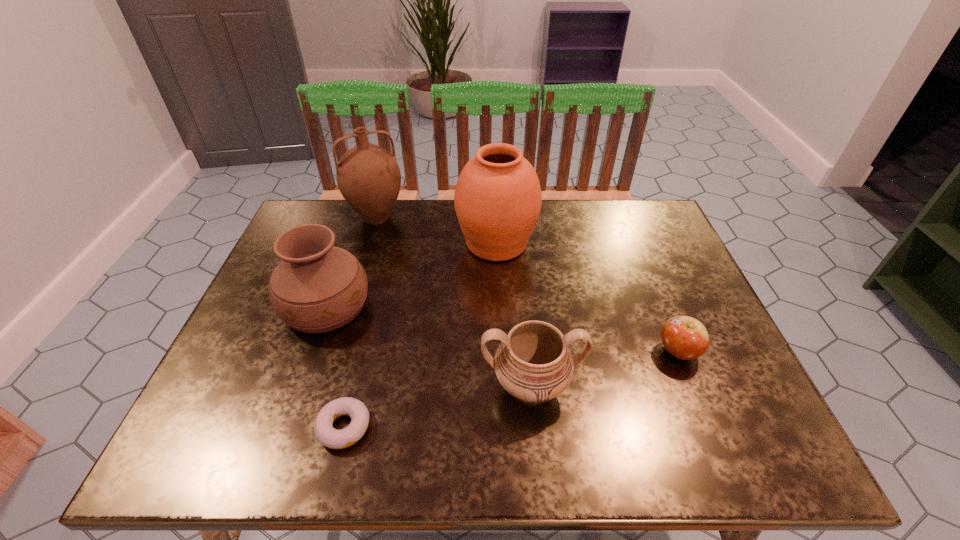
The width and height of the screenshot is (960, 540). I want to click on unoccupied area between the doughnut and the farthest urn, so coord(420,335).

Find the location of a particular element. The image size is (960, 540). unoccupied area between the shortest object and the shortest urn is located at coordinates click(437, 406).

At what (x,y) coordinates should I click in order to perform the action: click on vacant region between the tallest urn and the shortest object. Please return your answer as a coordinate pair (x, y). Image resolution: width=960 pixels, height=540 pixels. Looking at the image, I should click on (420, 335).

Find the location of a particular element. free spot between the farthest urn and the doughnut is located at coordinates (420, 335).

Locate an element on the screen. The image size is (960, 540). empty space that is in between the farthest urn and the second tallest urn is located at coordinates (411, 275).

I want to click on empty location between the doughnut and the leftmost urn, so click(335, 367).

Where is `object that is the closest to the pitcher`? This screenshot has width=960, height=540. object that is the closest to the pitcher is located at coordinates (498, 198).

Where is `the closest object to the second nearest urn`? The height and width of the screenshot is (540, 960). the closest object to the second nearest urn is located at coordinates (328, 436).

Select which urn appears as the closest to the second farthest urn. Please provide its 2D coordinates. Your answer should be formatted as a tuple, i.e. [(x, y)], where the tuple contains the x and y coordinates of a point satisfying the conditions above.

[(498, 198)]

Identify which urn is the second nearest to the apple. Please provide its 2D coordinates. Your answer should be formatted as a tuple, i.e. [(x, y)], where the tuple contains the x and y coordinates of a point satisfying the conditions above.

[(498, 198)]